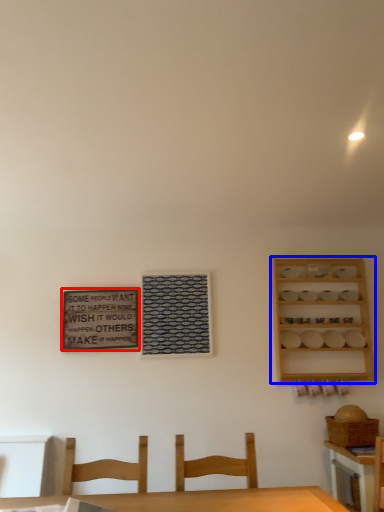
Question: Which point is further to the camera, bulletin board (highlighted by a red box) or shelf (highlighted by a blue box)?

Choices:
 (A) bulletin board
 (B) shelf

Answer: (A)